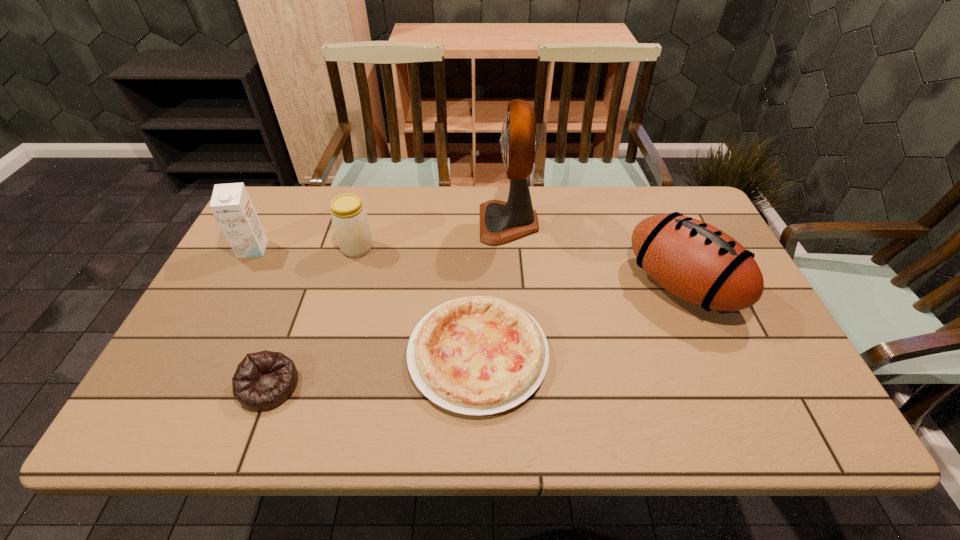
What are the coordinates of `the tallest object` in the screenshot? It's located at (501, 222).

This screenshot has width=960, height=540. Find the location of `the leftmost object`. the leftmost object is located at coordinates pos(231,205).

This screenshot has height=540, width=960. Identify the location of the rightmost object. (695, 261).

Identify the location of the fourth tallest object. 350,221.

Locate an element on the screen. This screenshot has width=960, height=540. beanbag is located at coordinates (263, 380).

Identify the location of pizza. (478, 355).

At what (x,y) coordinates should I click in order to perform the action: click on vacant space situated 0.250m on the front-facing side of the tallest object. Please return your answer as a coordinate pair (x, y). This screenshot has width=960, height=540. Looking at the image, I should click on (399, 223).

Where is `free point located 0.080m on the front-facing side of the tallest object`? Image resolution: width=960 pixels, height=540 pixels. free point located 0.080m on the front-facing side of the tallest object is located at coordinates (454, 223).

At what (x,y) coordinates should I click in order to perform the action: click on free location located 0.230m on the front-facing side of the tallest object. Please return your answer as a coordinate pair (x, y). Image resolution: width=960 pixels, height=540 pixels. Looking at the image, I should click on (406, 223).

The height and width of the screenshot is (540, 960). I want to click on vacant space situated 0.330m on the front of the carton, so click(x=197, y=356).